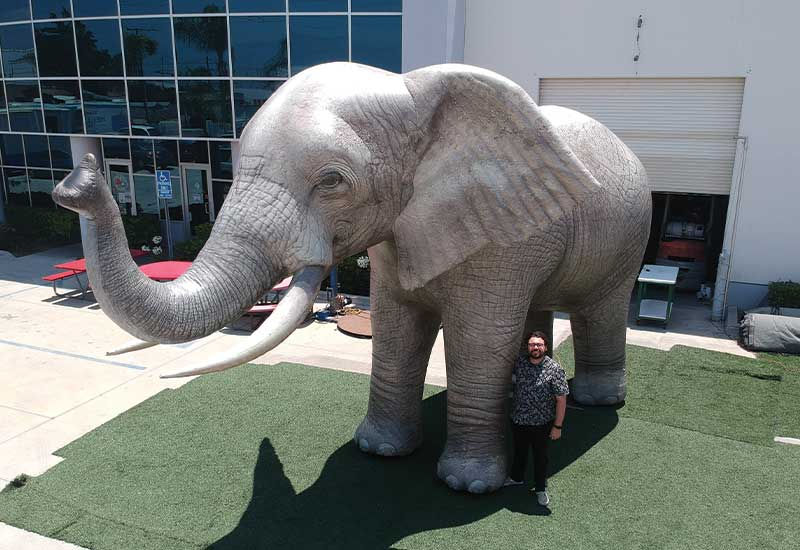
The height and width of the screenshot is (550, 800). Find the location of `wall`. wall is located at coordinates (770, 103).